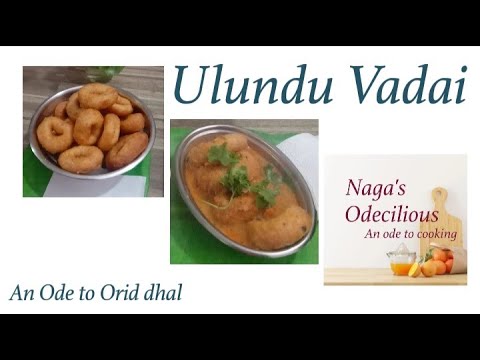
Find the location of `serving dish`. serving dish is located at coordinates (210, 228).